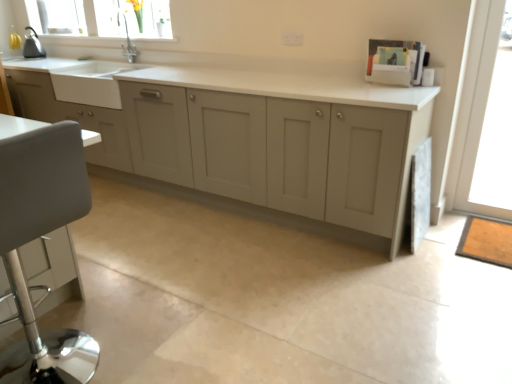
Question: Does clear glass window at upper left have a lesser height compared to transparent glass door at right?

Choices:
 (A) yes
 (B) no

Answer: (A)

Question: Does clear glass window at upper left have a lesser width compared to transparent glass door at right?

Choices:
 (A) yes
 (B) no

Answer: (B)

Question: From the image's perspective, is clear glass window at upper left under transparent glass door at right?

Choices:
 (A) no
 (B) yes

Answer: (A)

Question: Can you confirm if clear glass window at upper left is taller than transparent glass door at right?

Choices:
 (A) no
 (B) yes

Answer: (A)

Question: From a real-world perspective, is clear glass window at upper left physically below transparent glass door at right?

Choices:
 (A) no
 (B) yes

Answer: (A)

Question: From the image's perspective, is clear glass window at upper left located above or below white matte sink at left?

Choices:
 (A) above
 (B) below

Answer: (A)

Question: Looking at their shapes, would you say clear glass window at upper left is wider or thinner than white matte sink at left?

Choices:
 (A) wide
 (B) thin

Answer: (B)

Question: Considering the positions of clear glass window at upper left and white matte sink at left in the image, is clear glass window at upper left bigger or smaller than white matte sink at left?

Choices:
 (A) big
 (B) small

Answer: (B)

Question: Do you think clear glass window at upper left is within white matte sink at left, or outside of it?

Choices:
 (A) outside
 (B) inside

Answer: (A)

Question: Considering the relative positions of transparent glass door at right and white leather swivel chair at left in the image provided, is transparent glass door at right to the left or to the right of white leather swivel chair at left?

Choices:
 (A) left
 (B) right

Answer: (B)

Question: Does point (452, 192) appear closer or farther from the camera than point (44, 352)?

Choices:
 (A) closer
 (B) farther

Answer: (B)

Question: Looking at their shapes, would you say transparent glass door at right is wider or thinner than white leather swivel chair at left?

Choices:
 (A) thin
 (B) wide

Answer: (A)

Question: Looking at the image, does transparent glass door at right seem bigger or smaller compared to white leather swivel chair at left?

Choices:
 (A) small
 (B) big

Answer: (A)

Question: From a real-world perspective, is clear glass window at upper left positioned above or below matte gray cabinets at center?

Choices:
 (A) above
 (B) below

Answer: (A)

Question: From their relative heights in the image, would you say clear glass window at upper left is taller or shorter than matte gray cabinets at center?

Choices:
 (A) tall
 (B) short

Answer: (B)